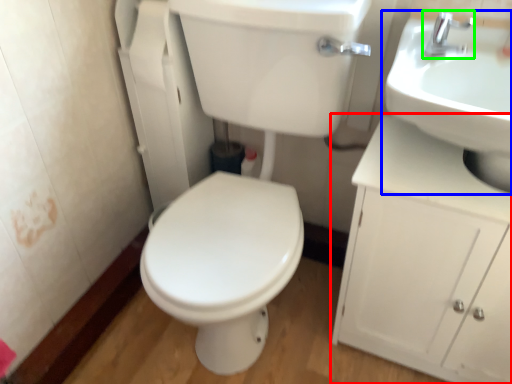
Question: Which object is the closest to the bathroom cabinet (highlighted by a red box)? Choose among these: sink (highlighted by a blue box) or tap (highlighted by a green box).

Choices:
 (A) sink
 (B) tap

Answer: (A)